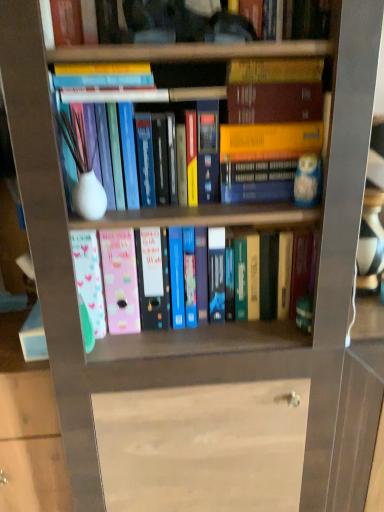
This screenshot has height=512, width=384. Describe the element at coordinates (103, 75) in the screenshot. I see `hardcover book at upper center, marked as the second book in a top-to-bottom arrangement` at that location.

Identify the location of hardcover book at upper center, arranged as the 3th book when ordered from the bottom. [x=103, y=75].

Does matte white vase at center, the third book when ordered from top to bottom, contain pastel plastic folders at center, the fourth book in the top-to-bottom sequence?

That's incorrect, pastel plastic folders at center, the fourth book in the top-to-bottom sequence, is not inside matte white vase at center, the third book when ordered from top to bottom.

Could you tell me if matte white vase at center, the 2th book positioned from the bottom, is facing pastel plastic folders at center, which is the 1th book in bottom-to-top order?

A: No.

Considering the relative positions of matte white vase at center, the third book when ordered from top to bottom, and pastel plastic folders at center, which is the 1th book in bottom-to-top order, in the image provided, is matte white vase at center, the third book when ordered from top to bottom, to the right of pastel plastic folders at center, which is the 1th book in bottom-to-top order, from the viewer's perspective?

Correct, you'll find matte white vase at center, the third book when ordered from top to bottom, to the right of pastel plastic folders at center, which is the 1th book in bottom-to-top order.

Who is shorter, matte white vase at center, the third book when ordered from top to bottom, or pastel plastic folders at center, the fourth book in the top-to-bottom sequence?

matte white vase at center, the third book when ordered from top to bottom, is shorter.

Could you tell me if hardcover book at upper center, marked as the second book in a top-to-bottom arrangement, is turned towards hardcover book at upper center, which is counted as the 4th book, starting from the bottom?

No, hardcover book at upper center, marked as the second book in a top-to-bottom arrangement, is not turned towards hardcover book at upper center, which is counted as the 4th book, starting from the bottom.

Are hardcover book at upper center, marked as the second book in a top-to-bottom arrangement, and hardcover book at upper center, which is counted as the 4th book, starting from the bottom, beside each other?

No, hardcover book at upper center, marked as the second book in a top-to-bottom arrangement, is not with hardcover book at upper center, which is counted as the 4th book, starting from the bottom.

Which of these two, hardcover book at upper center, arranged as the 3th book when ordered from the bottom, or hardcover book at upper center, which is counted as the 4th book, starting from the bottom, is smaller?

Smaller between the two is hardcover book at upper center, arranged as the 3th book when ordered from the bottom.

Does hardcover book at upper center, which is counted as the 4th book, starting from the bottom, have a lesser width compared to hardcover book at upper center, arranged as the 3th book when ordered from the bottom?

Indeed, hardcover book at upper center, which is counted as the 4th book, starting from the bottom, has a lesser width compared to hardcover book at upper center, arranged as the 3th book when ordered from the bottom.

Consider the image. From a real-world perspective, between hardcover book at upper center, placed as the first book when sorted from top to bottom, and hardcover book at upper center, arranged as the 3th book when ordered from the bottom, who is vertically higher?

hardcover book at upper center, placed as the first book when sorted from top to bottom, from a real-world perspective.

How distant is hardcover book at upper center, which is counted as the 4th book, starting from the bottom, from hardcover book at upper center, arranged as the 3th book when ordered from the bottom?

A distance of 10.22 centimeters exists between hardcover book at upper center, which is counted as the 4th book, starting from the bottom, and hardcover book at upper center, arranged as the 3th book when ordered from the bottom.

Can you confirm if hardcover book at upper center, which is counted as the 4th book, starting from the bottom, is positioned to the left of hardcover book at upper center, arranged as the 3th book when ordered from the bottom?

No.

In the scene shown: Is the depth of matte white vase at center, the 2th book positioned from the bottom, less than that of hardcover book at upper center, marked as the second book in a top-to-bottom arrangement?

No.

You are a GUI agent. You are given a task and a screenshot of the screen. Output one action in this format:
    pyautogui.click(x=<x>, y=<y>)
    Task: Click on the 1st book above the matte white vase at center, the third book when ordered from top to bottom (from the image's perspective)
    This screenshot has height=512, width=384.
    Given the screenshot: What is the action you would take?
    pyautogui.click(x=103, y=75)

Can hardcover book at upper center, arranged as the 3th book when ordered from the bottom, be found inside matte white vase at center, the 2th book positioned from the bottom?

Actually, hardcover book at upper center, arranged as the 3th book when ordered from the bottom, is outside matte white vase at center, the 2th book positioned from the bottom.

From the image's perspective, between matte white vase at center, the third book when ordered from top to bottom, and hardcover book at upper center, marked as the second book in a top-to-bottom arrangement, which one is located above?

hardcover book at upper center, marked as the second book in a top-to-bottom arrangement, from the image's perspective.

Who is more distant, pastel plastic folders at center, the fourth book in the top-to-bottom sequence, or hardcover book at upper center, marked as the second book in a top-to-bottom arrangement?

Positioned behind is pastel plastic folders at center, the fourth book in the top-to-bottom sequence.

Would you consider pastel plastic folders at center, the fourth book in the top-to-bottom sequence, to be distant from hardcover book at upper center, marked as the second book in a top-to-bottom arrangement?

Actually, pastel plastic folders at center, the fourth book in the top-to-bottom sequence, and hardcover book at upper center, marked as the second book in a top-to-bottom arrangement, are a little close together.

Consider the image. Can you confirm if pastel plastic folders at center, the fourth book in the top-to-bottom sequence, is positioned to the right of hardcover book at upper center, arranged as the 3th book when ordered from the bottom?

Yes.

From the image's perspective, which object appears higher, pastel plastic folders at center, which is the 1th book in bottom-to-top order, or hardcover book at upper center, arranged as the 3th book when ordered from the bottom?

hardcover book at upper center, arranged as the 3th book when ordered from the bottom, is shown above in the image.

Is matte white vase at center, the 2th book positioned from the bottom, wider or thinner than hardcover book at upper center, placed as the first book when sorted from top to bottom?

Considering their sizes, matte white vase at center, the 2th book positioned from the bottom, looks broader than hardcover book at upper center, placed as the first book when sorted from top to bottom.

Considering the positions of objects matte white vase at center, the third book when ordered from top to bottom, and hardcover book at upper center, placed as the first book when sorted from top to bottom, in the image provided, who is in front, matte white vase at center, the third book when ordered from top to bottom, or hardcover book at upper center, placed as the first book when sorted from top to bottom,?

Positioned in front is hardcover book at upper center, placed as the first book when sorted from top to bottom.

Which is closer to the camera, (x=218, y=138) or (x=51, y=7)?

Clearly, point (x=218, y=138) is more distant from the camera than point (x=51, y=7).

Considering the relative sizes of matte white vase at center, the 2th book positioned from the bottom, and hardcover book at upper center, placed as the first book when sorted from top to bottom, in the image provided, is matte white vase at center, the 2th book positioned from the bottom, smaller than hardcover book at upper center, placed as the first book when sorted from top to bottom,?

Incorrect, matte white vase at center, the 2th book positioned from the bottom, is not smaller in size than hardcover book at upper center, placed as the first book when sorted from top to bottom.

Considering the sizes of hardcover book at upper center, marked as the second book in a top-to-bottom arrangement, and matte white vase at center, the third book when ordered from top to bottom, in the image, is hardcover book at upper center, marked as the second book in a top-to-bottom arrangement, taller or shorter than matte white vase at center, the third book when ordered from top to bottom,?

Clearly, hardcover book at upper center, marked as the second book in a top-to-bottom arrangement, is shorter compared to matte white vase at center, the third book when ordered from top to bottom.

Is hardcover book at upper center, arranged as the 3th book when ordered from the bottom, at the left side of matte white vase at center, the 2th book positioned from the bottom?

Yes.

Which is farther, (103, 73) or (194, 119)?

Point (194, 119)

From the image's perspective, count 1st books upward from the pastel plastic folders at center, the fourth book in the top-to-bottom sequence, and point to it. Please provide its 2D coordinates.

[(195, 151)]

This screenshot has width=384, height=512. Find the location of `the 3rd book to the left when counting from the hardcover book at upper center, placed as the first book when sorted from top to bottom`. the 3rd book to the left when counting from the hardcover book at upper center, placed as the first book when sorted from top to bottom is located at coordinates (103, 75).

Which object lies further to the anchor point pastel plastic folders at center, which is the 1th book in bottom-to-top order, matte white vase at center, the third book when ordered from top to bottom, or hardcover book at upper center, placed as the first book when sorted from top to bottom?

hardcover book at upper center, placed as the first book when sorted from top to bottom.

Which object lies further to the anchor point hardcover book at upper center, which is counted as the 4th book, starting from the bottom, pastel plastic folders at center, the fourth book in the top-to-bottom sequence, or hardcover book at upper center, marked as the second book in a top-to-bottom arrangement?

pastel plastic folders at center, the fourth book in the top-to-bottom sequence.

When comparing their distances from hardcover book at upper center, arranged as the 3th book when ordered from the bottom, does hardcover book at upper center, placed as the first book when sorted from top to bottom, or matte white vase at center, the third book when ordered from top to bottom, seem closer?

hardcover book at upper center, placed as the first book when sorted from top to bottom, is positioned closer to the anchor hardcover book at upper center, arranged as the 3th book when ordered from the bottom.

When comparing their distances from hardcover book at upper center, arranged as the 3th book when ordered from the bottom, does pastel plastic folders at center, which is the 1th book in bottom-to-top order, or matte white vase at center, the third book when ordered from top to bottom, seem closer?

matte white vase at center, the third book when ordered from top to bottom, lies closer to hardcover book at upper center, arranged as the 3th book when ordered from the bottom, than the other object.

Based on their spatial positions, is matte white vase at center, the third book when ordered from top to bottom, or hardcover book at upper center, arranged as the 3th book when ordered from the bottom, further from hardcover book at upper center, which is counted as the 4th book, starting from the bottom?

matte white vase at center, the third book when ordered from top to bottom, lies further to hardcover book at upper center, which is counted as the 4th book, starting from the bottom, than the other object.

When comparing their distances from pastel plastic folders at center, which is the 1th book in bottom-to-top order, does hardcover book at upper center, marked as the second book in a top-to-bottom arrangement, or hardcover book at upper center, placed as the first book when sorted from top to bottom, seem further?

hardcover book at upper center, placed as the first book when sorted from top to bottom, is further to pastel plastic folders at center, which is the 1th book in bottom-to-top order.

Estimate the real-world distances between objects in this image. Which object is further from matte white vase at center, the 2th book positioned from the bottom, hardcover book at upper center, which is counted as the 4th book, starting from the bottom, or pastel plastic folders at center, the fourth book in the top-to-bottom sequence?

pastel plastic folders at center, the fourth book in the top-to-bottom sequence.

Looking at the image, which one is located further to hardcover book at upper center, placed as the first book when sorted from top to bottom, matte white vase at center, the third book when ordered from top to bottom, or pastel plastic folders at center, which is the 1th book in bottom-to-top order?

pastel plastic folders at center, which is the 1th book in bottom-to-top order, is further to hardcover book at upper center, placed as the first book when sorted from top to bottom.

Find the location of a particular element. The image size is (384, 512). book between hardcover book at upper center, marked as the second book in a top-to-bottom arrangement, and pastel plastic folders at center, the fourth book in the top-to-bottom sequence, from top to bottom is located at coordinates (195, 151).

Find the location of a particular element. The height and width of the screenshot is (512, 384). book between hardcover book at upper center, which is counted as the 4th book, starting from the bottom, and matte white vase at center, the third book when ordered from top to bottom, in the up-down direction is located at coordinates (103, 75).